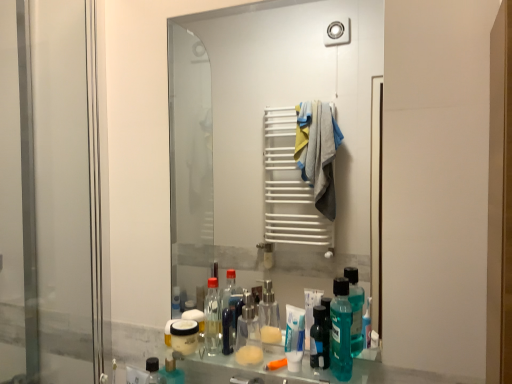
Question: Does teal plastic mouthwash at lower center have a lesser width compared to clear glass mirror at center?

Choices:
 (A) yes
 (B) no

Answer: (B)

Question: From a real-world perspective, is teal plastic mouthwash at lower center located beneath clear glass mirror at center?

Choices:
 (A) no
 (B) yes

Answer: (B)

Question: Considering the relative sizes of teal plastic mouthwash at lower center and clear glass mirror at center in the image provided, is teal plastic mouthwash at lower center wider than clear glass mirror at center?

Choices:
 (A) no
 (B) yes

Answer: (B)

Question: Is teal plastic mouthwash at lower center located outside clear glass mirror at center?

Choices:
 (A) yes
 (B) no

Answer: (A)

Question: From a real-world perspective, is teal plastic mouthwash at lower center over clear glass mirror at center?

Choices:
 (A) yes
 (B) no

Answer: (B)

Question: From their relative heights in the image, would you say teal plastic mouthwash at lower center is taller or shorter than transparent glass screen door at left?

Choices:
 (A) short
 (B) tall

Answer: (A)

Question: Relative to transparent glass screen door at left, is teal plastic mouthwash at lower center in front or behind?

Choices:
 (A) front
 (B) behind

Answer: (A)

Question: Visually, is teal plastic mouthwash at lower center positioned to the left or to the right of transparent glass screen door at left?

Choices:
 (A) right
 (B) left

Answer: (A)

Question: Is teal plastic mouthwash at lower center situated inside transparent glass screen door at left or outside?

Choices:
 (A) outside
 (B) inside

Answer: (A)

Question: Relative to clear glass mirror at center, is transparent plastic mouthwash at center in front or behind?

Choices:
 (A) front
 (B) behind

Answer: (B)

Question: In terms of size, does transparent plastic mouthwash at center appear bigger or smaller than clear glass mirror at center?

Choices:
 (A) big
 (B) small

Answer: (B)

Question: Is transparent plastic mouthwash at center wider or thinner than clear glass mirror at center?

Choices:
 (A) wide
 (B) thin

Answer: (A)

Question: Which is correct: transparent plastic mouthwash at center is inside clear glass mirror at center, or outside of it?

Choices:
 (A) inside
 (B) outside

Answer: (B)

Question: Relative to transparent plastic mouthwash at center, is transparent glass screen door at left in front or behind?

Choices:
 (A) front
 (B) behind

Answer: (A)

Question: Considering the positions of transparent glass screen door at left and transparent plastic mouthwash at center in the image, is transparent glass screen door at left wider or thinner than transparent plastic mouthwash at center?

Choices:
 (A) thin
 (B) wide

Answer: (A)